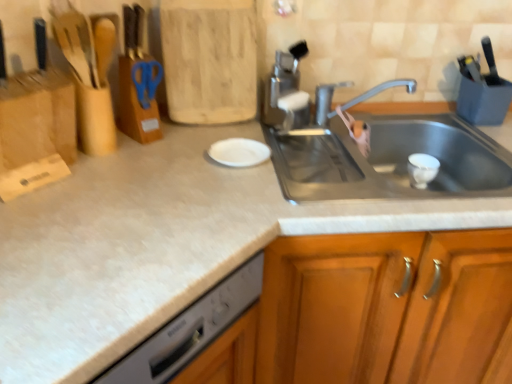
Question: Which is correct: blue plastic scissors at upper center is inside silver metallic faucet at upper center, or outside of it?

Choices:
 (A) outside
 (B) inside

Answer: (A)

Question: Is blue plastic scissors at upper center wider or thinner than silver metallic faucet at upper center?

Choices:
 (A) wide
 (B) thin

Answer: (B)

Question: Estimate the real-world distances between objects in this image. Which object is farther from the silver metallic faucet at upper center?

Choices:
 (A) white matte plate at center
 (B) blue plastic scissors at upper center
 (C) satin nickel faucet at upper center
 (D) wooden cabinet at center

Answer: (D)

Question: Estimate the real-world distances between objects in this image. Which object is farther from the blue plastic scissors at upper center?

Choices:
 (A) white matte plate at center
 (B) satin nickel faucet at upper center
 (C) silver metallic faucet at upper center
 (D) wooden cabinet at center

Answer: (D)